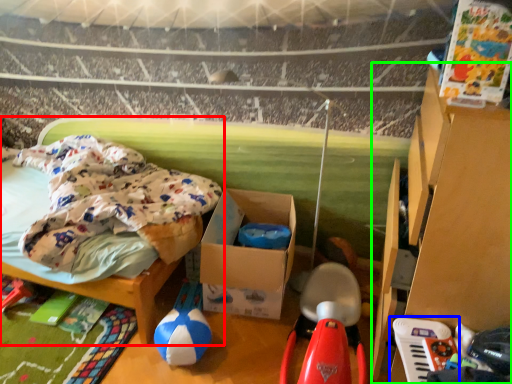
Question: Which is farther away from furniture (highlighted by a red box)? toy (highlighted by a blue box) or furniture (highlighted by a green box)?

Choices:
 (A) toy
 (B) furniture

Answer: (A)